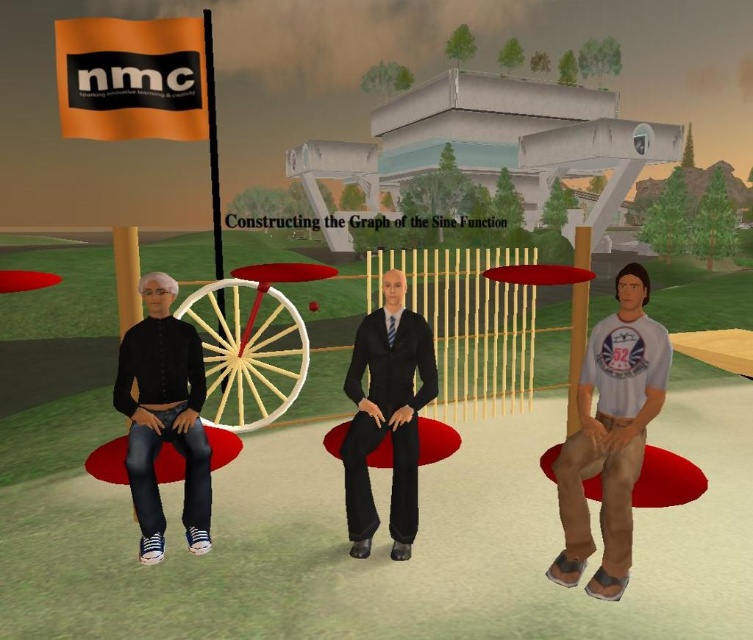
Based on the photo, you are trying to decide which piece of clothing to choose for a casual outing. Based on the image, which item is bigger between the black matte jeans at left and the matte black suit at center?

The black matte jeans at left is larger in size compared to the matte black suit at center, so it would be the bigger option for your casual outing.